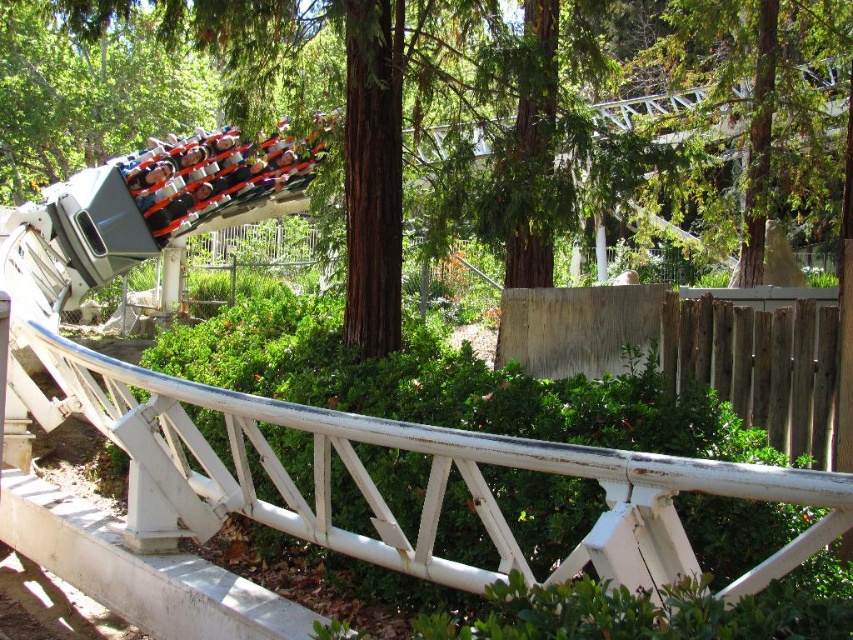
Who is more forward, (x=662, y=529) or (x=821, y=32)?

Positioned in front is point (x=662, y=529).

Is point (236, 448) closer to viewer compared to point (691, 10)?

Yes, it is.

Between point (695, 465) and point (772, 48), which one is positioned in front?

Point (695, 465) is in front.

Find the location of a particular element. white matte roller coaster rail at center is located at coordinates (426, 481).

Can you confirm if white matte roller coaster rail at center is taller than matte black roller coaster at upper left?

In fact, white matte roller coaster rail at center may be shorter than matte black roller coaster at upper left.

Is point (384, 516) positioned in front of point (234, 202)?

That is True.

This screenshot has height=640, width=853. I want to click on white matte roller coaster rail at center, so click(426, 481).

Can you confirm if green textured tree at upper center is thinner than matte black roller coaster at upper left?

Indeed, green textured tree at upper center has a lesser width compared to matte black roller coaster at upper left.

Between green textured tree at upper center and matte black roller coaster at upper left, which one appears on the left side from the viewer's perspective?

From the viewer's perspective, matte black roller coaster at upper left appears more on the left side.

Describe the element at coordinates (761, 83) in the screenshot. I see `green textured tree at upper center` at that location.

The height and width of the screenshot is (640, 853). In order to click on green textured tree at upper center in this screenshot , I will do `click(761, 83)`.